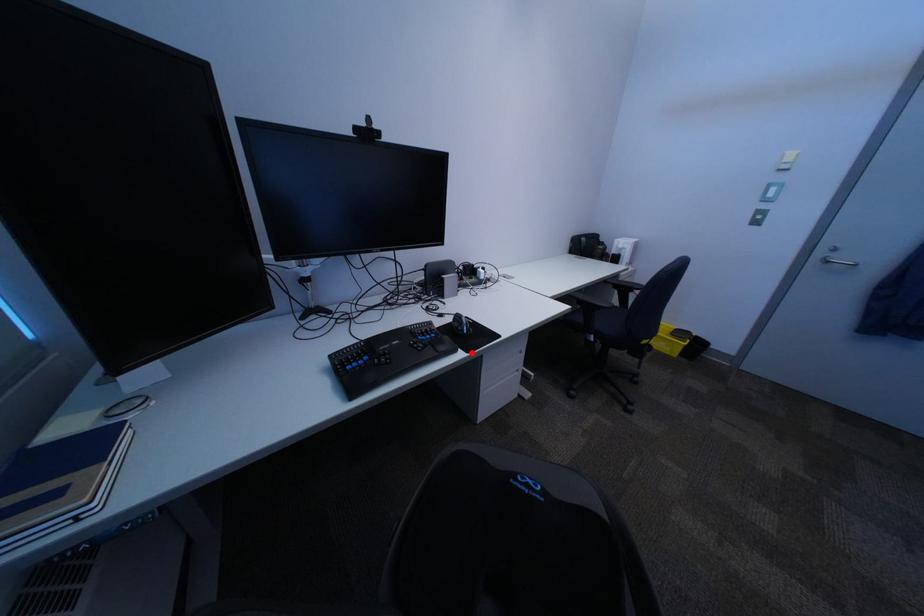
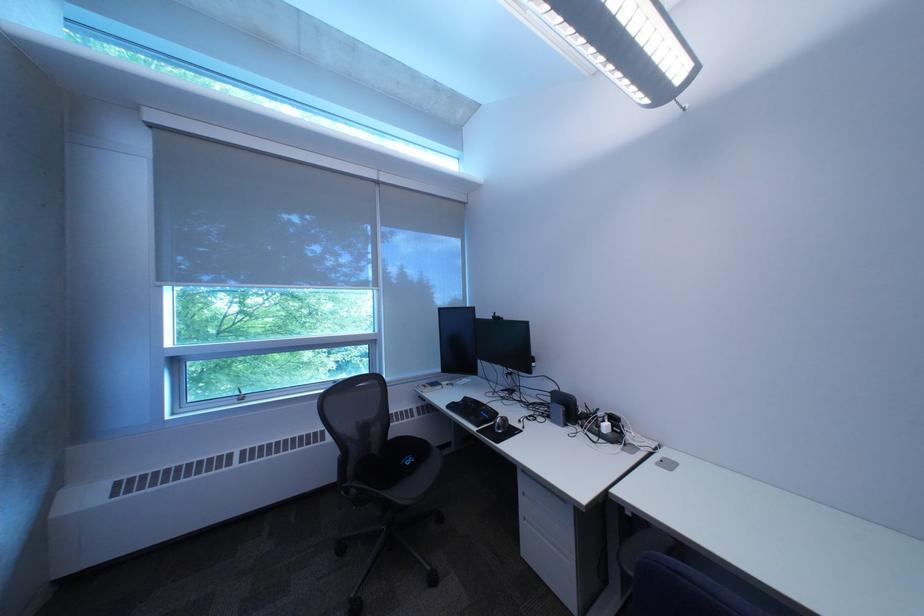
Find the pixel in the second image that matches the highlighted location in the first image.

(492, 429)